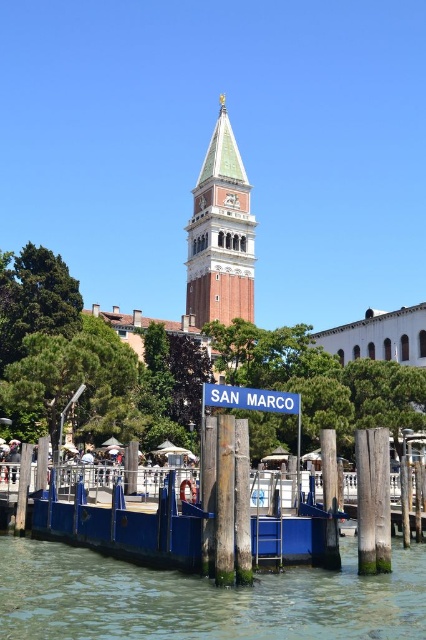
You are a tourist visiting San Marco and want to take a photo of the green copper bell tower at center. However, you notice that the clear water at lower center might block your view. Based on their sizes, which object takes up more space in the image?

The green copper bell tower at center takes up more space in the image than the clear water at lower center because the clear water at lower center occupies less space than the green copper bell tower at center.

You are standing on the floating dock labeled SAN MARCO and looking towards the Campanile di San Marco. Where is the clear water at lower center located in relation to the dock?

The clear water at lower center is located at the point with coordinates (x=203, y=598) in the image, which places it directly in front of the floating dock labeled SAN MARCO.

You are a tourist standing on the floating dock at San Marco. You notice the clear water at lower center and the green copper bell tower at center. Which object is wider from your perspective?

The clear water at lower center is wider than the green copper bell tower at center from your perspective.